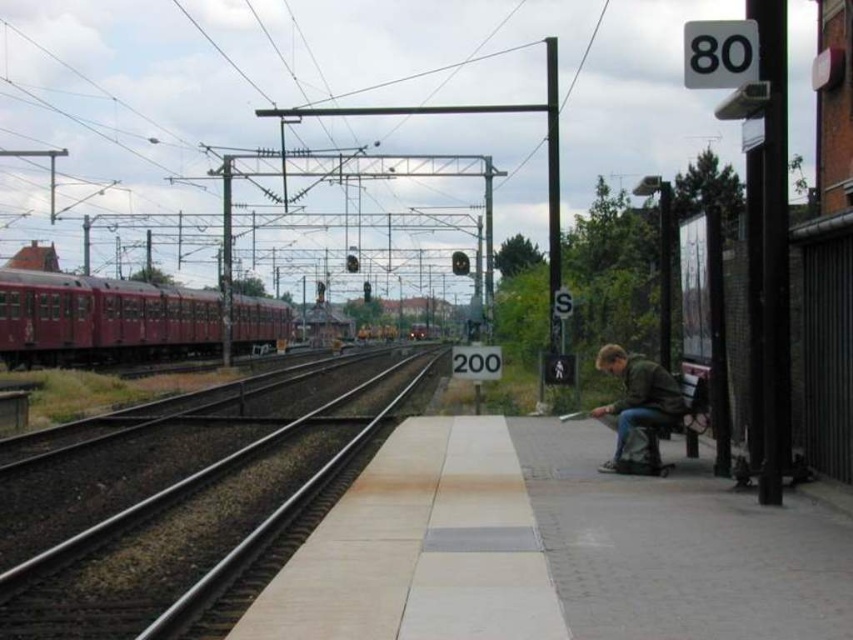
Question: Based on their relative distances, which object is nearer to the smooth metal train track at center?

Choices:
 (A) maroon metallic train at left
 (B) green matte jacket at lower right

Answer: (B)

Question: Among these points, which one is nearest to the camera?

Choices:
 (A) (619, 410)
 (B) (260, 509)
 (C) (28, 346)

Answer: (A)

Question: Which object appears closest to the camera in this image?

Choices:
 (A) smooth metal train track at center
 (B) green matte jacket at lower right
 (C) maroon metallic train at left

Answer: (A)

Question: Observing the image, what is the correct spatial positioning of maroon metallic train at left in reference to green matte jacket at lower right?

Choices:
 (A) left
 (B) right

Answer: (A)

Question: Can you confirm if smooth metal train track at center is thinner than maroon metallic train at left?

Choices:
 (A) yes
 (B) no

Answer: (B)

Question: Is maroon metallic train at left above green matte jacket at lower right?

Choices:
 (A) yes
 (B) no

Answer: (A)